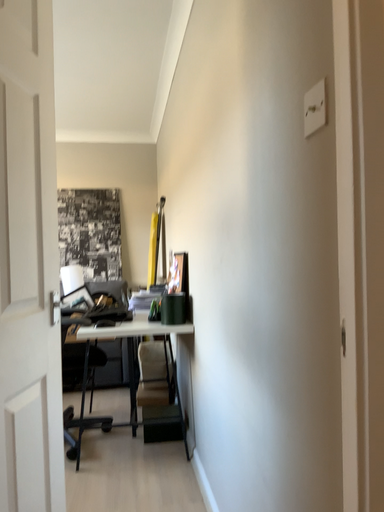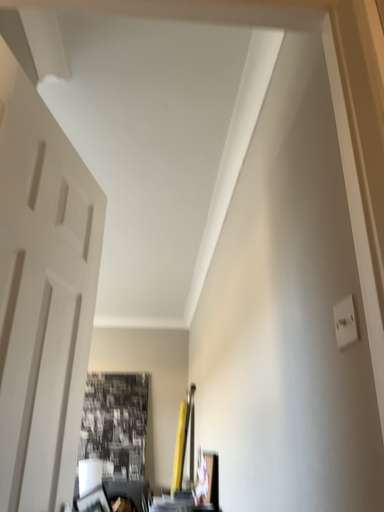
Question: How did the camera likely rotate when shooting the video?

Choices:
 (A) rotated upward
 (B) rotated downward

Answer: (A)